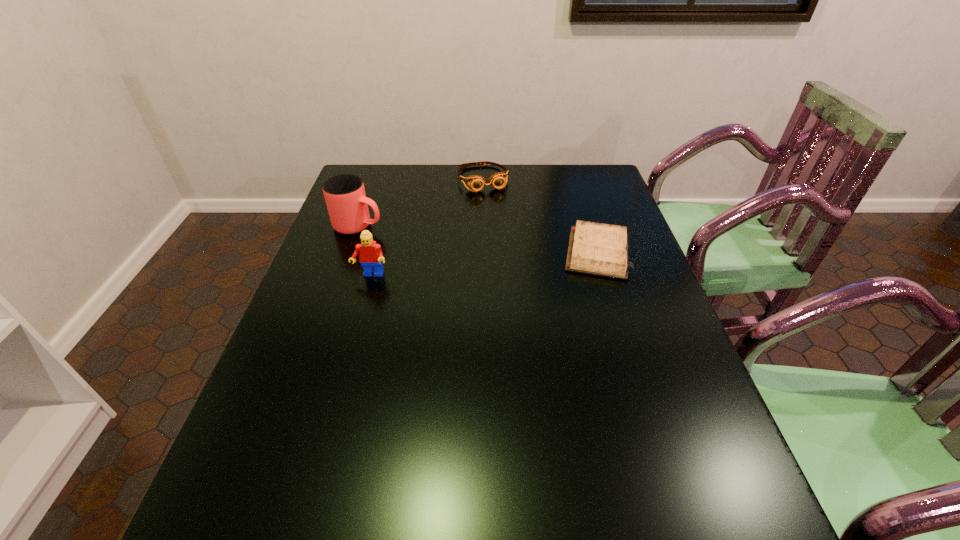
Where is `vacant area at the left edge of the desktop`? Image resolution: width=960 pixels, height=540 pixels. vacant area at the left edge of the desktop is located at coordinates (360, 262).

Where is `vacant space at the right edge of the desktop`? This screenshot has width=960, height=540. vacant space at the right edge of the desktop is located at coordinates (660, 318).

In the image, there is a desktop. Where is `vacant space at the near left corner`? The height and width of the screenshot is (540, 960). vacant space at the near left corner is located at coordinates (277, 470).

Where is `vacant space at the near right corner of the desktop`? The image size is (960, 540). vacant space at the near right corner of the desktop is located at coordinates (729, 469).

You are a GUI agent. You are given a task and a screenshot of the screen. Output one action in this format:
    pyautogui.click(x=<x>, y=<y>)
    Task: Click on the vacant space in between the rightmost object and the goggles
    The image size is (960, 540).
    Given the screenshot: What is the action you would take?
    pyautogui.click(x=540, y=215)

Where is `empty space between the farthest object and the Lego`? empty space between the farthest object and the Lego is located at coordinates (427, 227).

Locate an element on the screen. The image size is (960, 540). blank region between the diary and the second object from right to left is located at coordinates (540, 215).

Find the location of a particular element. vacant region between the goggles and the cup is located at coordinates tap(421, 202).

Find the location of a particular element. This screenshot has height=540, width=960. free point between the second object from right to left and the Lego is located at coordinates (427, 227).

The height and width of the screenshot is (540, 960). I want to click on empty space that is in between the third object from left to right and the diary, so click(x=540, y=215).